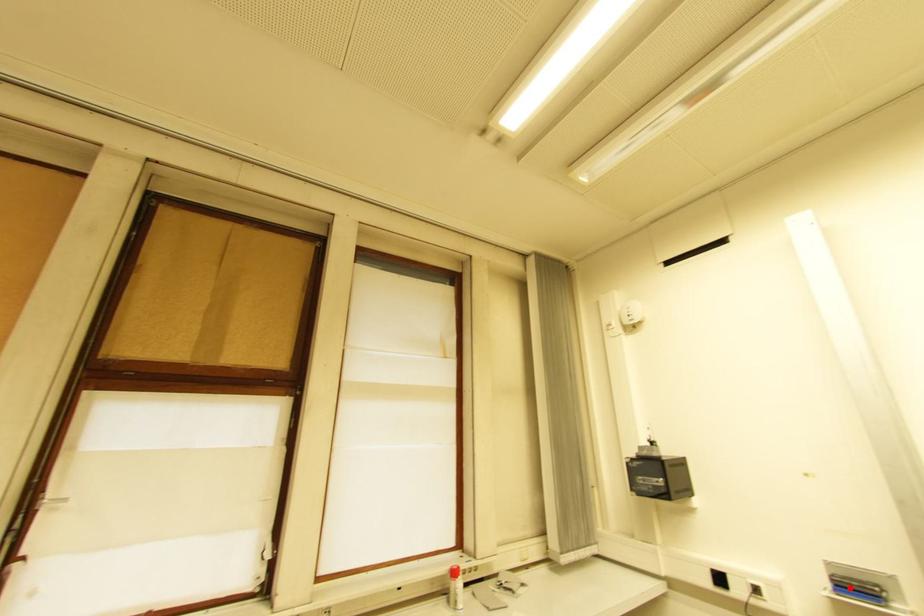
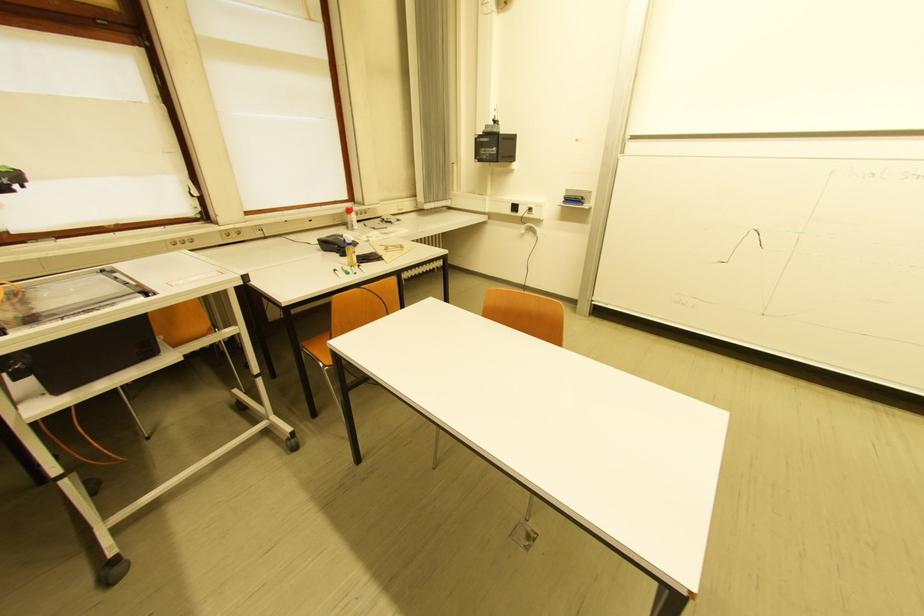
Question: I am providing you with two images of the same scene from different viewpoints. A red point is marked on the first image. Can you still see the location of the red point in image 2?

Choices:
 (A) Yes
 (B) No

Answer: (A)